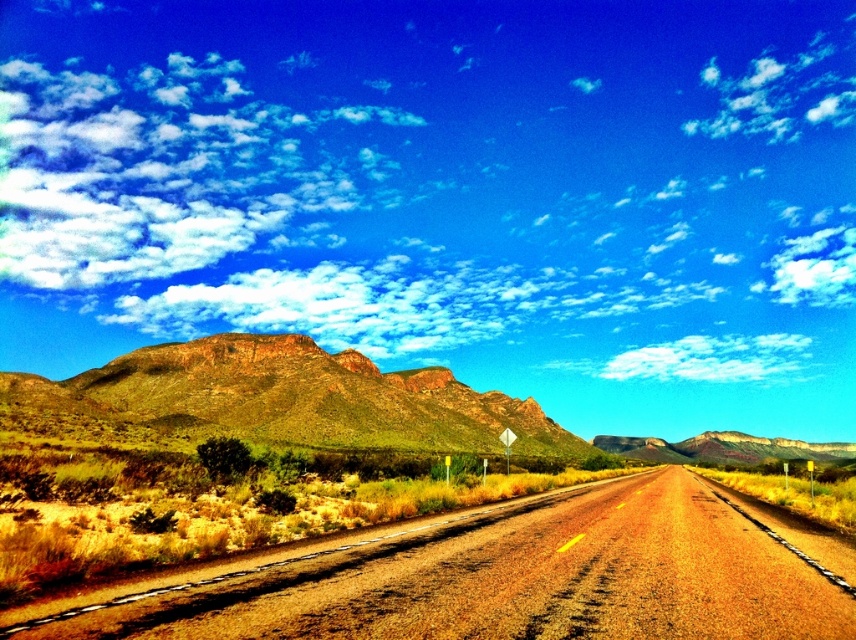
Question: Which point is closer to the camera?

Choices:
 (A) green grassy mountain at left
 (B) dried grass at center

Answer: (B)

Question: Which of the following is the closest to the observer?

Choices:
 (A) green grassy mountain at left
 (B) dried grass at center

Answer: (B)

Question: Among these points, which one is nearest to the camera?

Choices:
 (A) (373, 566)
 (B) (450, 403)

Answer: (A)

Question: Is dried grass at center closer to camera compared to green grassy mountain at left?

Choices:
 (A) yes
 (B) no

Answer: (A)

Question: Is dried grass at center smaller than green grassy mountain at left?

Choices:
 (A) yes
 (B) no

Answer: (A)

Question: Can you confirm if dried grass at center is positioned above green grassy mountain at left?

Choices:
 (A) no
 (B) yes

Answer: (B)